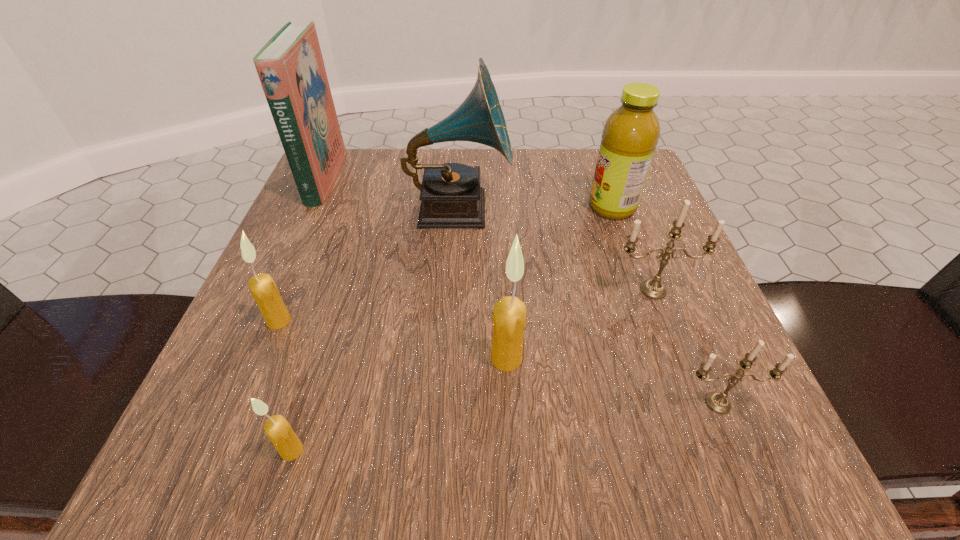
At what (x,y) coordinates should I click in order to perform the action: click on vacant area that lies between the fourth farthest candle and the second farthest cream candle. Please return your answer as a coordinate pair (x, y). The width and height of the screenshot is (960, 540). Looking at the image, I should click on (612, 381).

Find the location of a particular element. The height and width of the screenshot is (540, 960). free spot between the smaller metallic candle and the fruit juice is located at coordinates (665, 305).

This screenshot has height=540, width=960. Find the location of `unoccupied area between the tallest candle and the bigger metallic candle`. unoccupied area between the tallest candle and the bigger metallic candle is located at coordinates (580, 324).

At what (x,y) coordinates should I click in order to perform the action: click on empty location between the phonograph_record and the fourth farthest candle. Please return your answer as a coordinate pair (x, y). Looking at the image, I should click on (588, 306).

Image resolution: width=960 pixels, height=540 pixels. Find the location of `vacant area between the leftmost candle and the hardback book`. vacant area between the leftmost candle and the hardback book is located at coordinates (302, 250).

The width and height of the screenshot is (960, 540). Find the location of `vacant space in between the seventh farthest object and the nearest object`. vacant space in between the seventh farthest object and the nearest object is located at coordinates pos(505,427).

I want to click on empty location between the nearest cream candle and the phonograph_record, so click(x=375, y=329).

Locate an element on the screen. vacant space in between the fruit juice and the nearer metallic candle is located at coordinates (665, 305).

Choose which object is the third nearest neighbor to the second biggest cream candle. Please provide its 2D coordinates. Your answer should be formatted as a tuple, i.e. [(x, y)], where the tuple contains the x and y coordinates of a point satisfying the conditions above.

[(290, 66)]

Find the location of `object that ranks as the seventh closest to the third candle from left to right`. object that ranks as the seventh closest to the third candle from left to right is located at coordinates (290, 66).